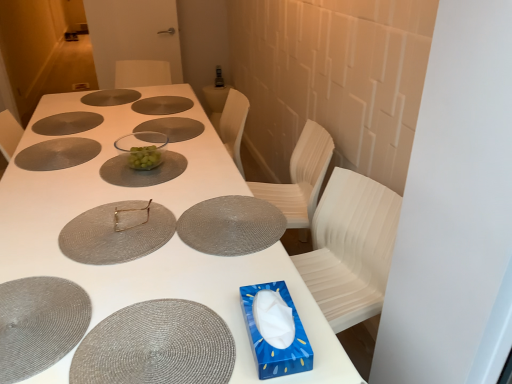
I want to click on vacant area that lies between matte gray glass plate at upper center, which is the 9th glass plate from front to back, and matte silver fork at center, so click(x=108, y=139).